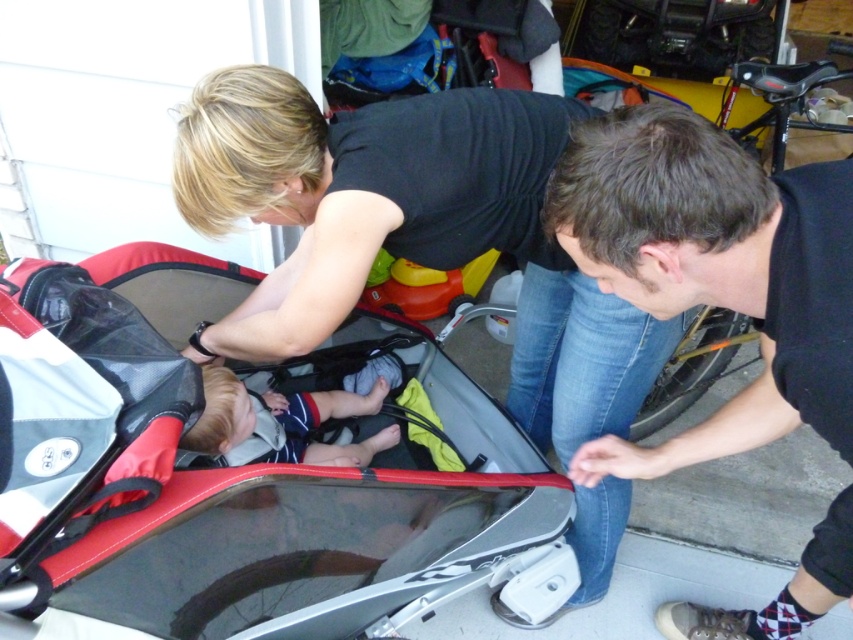
You are a photographer trying to capture a closeup of the dark brown hair at lower right and the soft beige fabric baby at center. Which object should you focus on first to ensure it appears sharp in the photo?

The dark brown hair at lower right is closer to the viewer than the soft beige fabric baby at center, so you should focus on the dark brown hair at lower right first to ensure it appears sharp.

You are a photographer trying to capture a clear photo of the soft beige fabric baby at center. The red plastic baby carriage at center is blocking your view. Can you adjust your position to take the photo without moving the carriage?

The red plastic baby carriage at center is below the soft beige fabric baby at center, so you can adjust your position to take the photo by moving your camera above the carriage to capture the baby without obstruction.